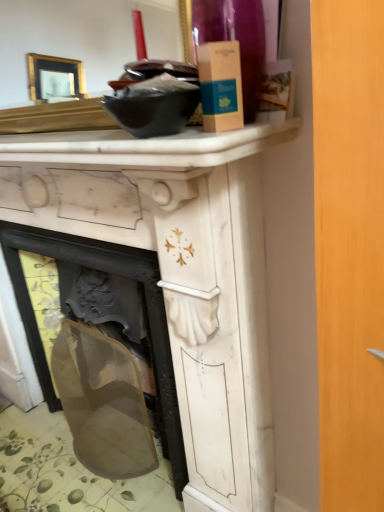
This screenshot has width=384, height=512. What do you see at coordinates (146, 146) in the screenshot? I see `white marble counter top at upper center` at bounding box center [146, 146].

Find the location of a particular element. The image size is (384, 512). white marble fireplace at center is located at coordinates (178, 273).

This screenshot has width=384, height=512. What are the coordinates of `white marble counter top at upper center` in the screenshot? It's located at (x=146, y=146).

Is white marble counter top at upper center bigger than white marble fireplace at center?

Actually, white marble counter top at upper center might be smaller than white marble fireplace at center.

From the image's perspective, who appears lower, white marble counter top at upper center or white marble fireplace at center?

white marble fireplace at center.

Could you tell me if white marble counter top at upper center is turned towards white marble fireplace at center?

No, white marble counter top at upper center is not facing towards white marble fireplace at center.

Which object is further away from the camera, white marble counter top at upper center or white marble fireplace at center?

white marble fireplace at center is further from the camera.

From the image's perspective, would you say transparent plastic screen at lower left is shown under white marble counter top at upper center?

Indeed, from the image's perspective, transparent plastic screen at lower left is shown beneath white marble counter top at upper center.

Considering the sizes of objects transparent plastic screen at lower left and white marble counter top at upper center in the image provided, who is bigger, transparent plastic screen at lower left or white marble counter top at upper center?

transparent plastic screen at lower left.

From a real-world perspective, who is located lower, transparent plastic screen at lower left or white marble counter top at upper center?

From a 3D spatial view, transparent plastic screen at lower left is below.

Is transparent plastic screen at lower left facing towards white marble counter top at upper center?

No, transparent plastic screen at lower left is not facing towards white marble counter top at upper center.

Consider the image. From the image's perspective, is white marble counter top at upper center above transparent plastic screen at lower left?

Yes, from the image's perspective, white marble counter top at upper center is over transparent plastic screen at lower left.

Is white marble counter top at upper center completely or partially outside of transparent plastic screen at lower left?

Yes, white marble counter top at upper center is located beyond the bounds of transparent plastic screen at lower left.

Is the depth of white marble counter top at upper center less than that of transparent plastic screen at lower left?

Yes, it is in front of transparent plastic screen at lower left.

From a real-world perspective, between white marble counter top at upper center and transparent plastic screen at lower left, who is vertically lower?

In real-world perspective, transparent plastic screen at lower left is lower.

Considering the sizes of objects transparent plastic screen at lower left and white marble fireplace at center in the image provided, who is wider, transparent plastic screen at lower left or white marble fireplace at center?

With larger width is transparent plastic screen at lower left.

Which of these two, transparent plastic screen at lower left or white marble fireplace at center, is smaller?

transparent plastic screen at lower left.

From a real-world perspective, is transparent plastic screen at lower left physically above white marble fireplace at center?

No.

Is transparent plastic screen at lower left aimed at white marble fireplace at center?

No, transparent plastic screen at lower left is not facing towards white marble fireplace at center.

Considering their positions, is white marble fireplace at center located in front of or behind white marble counter top at upper center?

white marble fireplace at center is positioned farther from the viewer than white marble counter top at upper center.

From the image's perspective, would you say white marble fireplace at center is positioned over white marble counter top at upper center?

Incorrect, from the image's perspective, white marble fireplace at center is lower than white marble counter top at upper center.

Does point (12, 155) lie behind point (50, 162)?

Yes, point (12, 155) is behind point (50, 162).

Is white marble fireplace at center far away from white marble counter top at upper center?

They are positioned close to each other.

Is the depth of white marble fireplace at center less than that of transparent plastic screen at lower left?

Yes, the depth of white marble fireplace at center is less than that of transparent plastic screen at lower left.

Is white marble fireplace at center looking in the opposite direction of transparent plastic screen at lower left?

No, transparent plastic screen at lower left is not at the back of white marble fireplace at center.

From a real-world perspective, which is physically below, white marble fireplace at center or transparent plastic screen at lower left?

From a 3D spatial view, transparent plastic screen at lower left is below.

Locate an element on the screen. vanity below the white marble counter top at upper center (from a real-world perspective) is located at coordinates (178, 273).

You are a GUI agent. You are given a task and a screenshot of the screen. Output one action in this format:
    pyautogui.click(x=<x>, y=<y>)
    Task: Click on the tile below the white marble counter top at upper center (from the image's perspective)
    The image size is (384, 512).
    Given the screenshot: What is the action you would take?
    pyautogui.click(x=68, y=471)

Looking at the image, which one is located further to transparent plastic screen at lower left, white marble counter top at upper center or white marble fireplace at center?

A: Among the two, white marble counter top at upper center is located further to transparent plastic screen at lower left.

Looking at the image, which one is located further to white marble fireplace at center, white marble counter top at upper center or transparent plastic screen at lower left?

transparent plastic screen at lower left is positioned further to the anchor white marble fireplace at center.

Consider the image. Which object lies nearer to the anchor point transparent plastic screen at lower left, white marble fireplace at center or white marble counter top at upper center?

white marble fireplace at center is positioned closer to the anchor transparent plastic screen at lower left.

Based on their spatial positions, is white marble fireplace at center or transparent plastic screen at lower left further from white marble counter top at upper center?

transparent plastic screen at lower left is positioned further to the anchor white marble counter top at upper center.

When comparing their distances from white marble counter top at upper center, does transparent plastic screen at lower left or white marble fireplace at center seem closer?

Based on the image, white marble fireplace at center appears to be nearer to white marble counter top at upper center.

Estimate the real-world distances between objects in this image. Which object is closer to white marble fireplace at center, transparent plastic screen at lower left or white marble counter top at upper center?

white marble counter top at upper center lies closer to white marble fireplace at center than the other object.

This screenshot has height=512, width=384. Find the location of `vanity that lies between white marble counter top at upper center and transparent plastic screen at lower left from top to bottom`. vanity that lies between white marble counter top at upper center and transparent plastic screen at lower left from top to bottom is located at coordinates (178, 273).